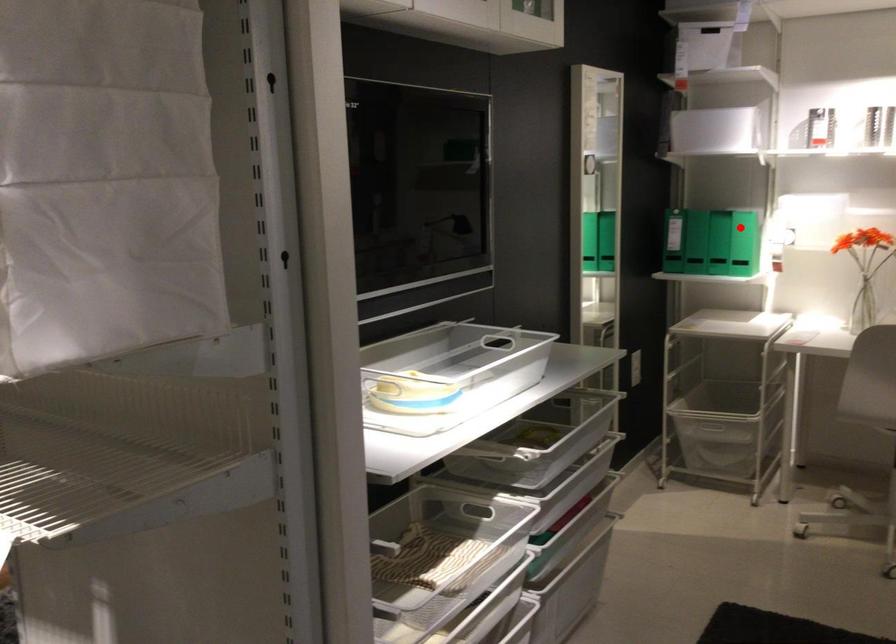
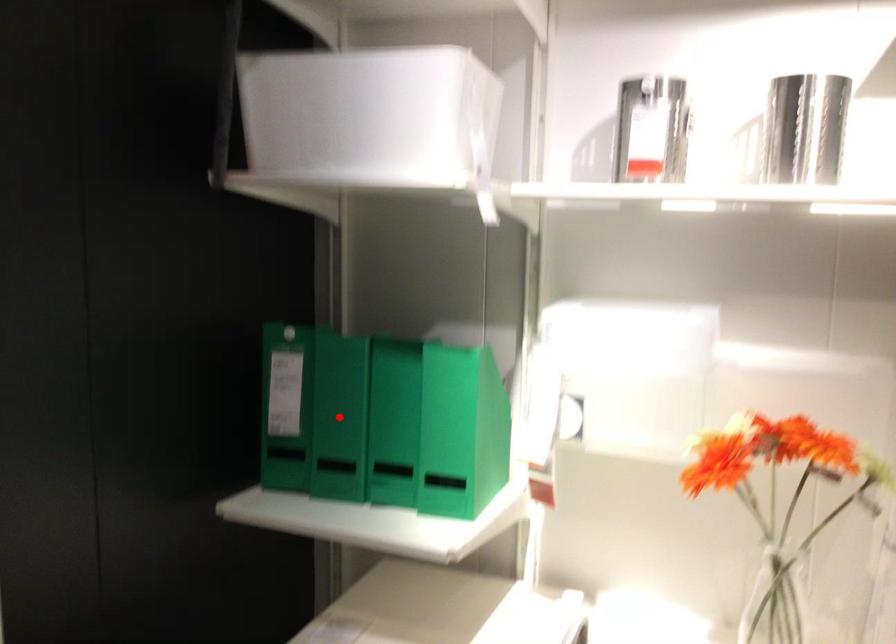
I am providing you with two images of the same scene from different viewpoints. A red point is marked on the first image and another point is marked on the second image. Does the point marked in image1 correspond to the same location as the one in image2?

No